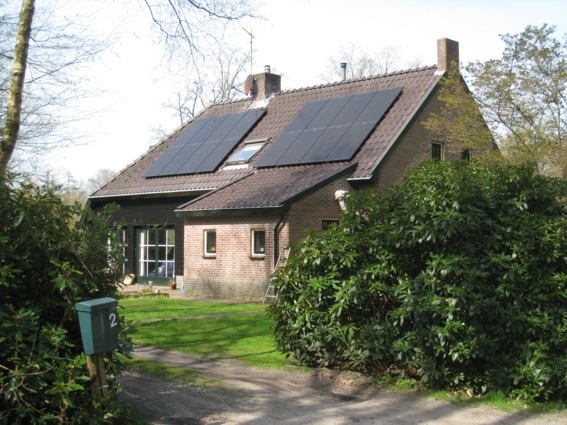
Where is `window`? window is located at coordinates (208, 239).